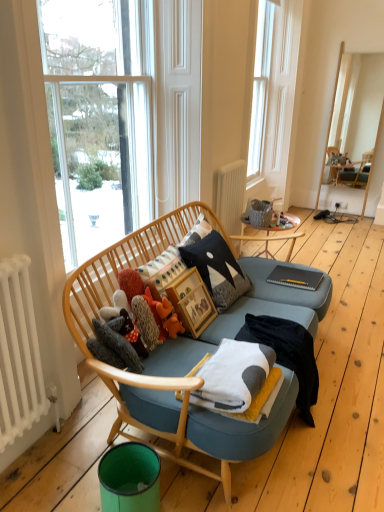
Question: Considering their positions, is transparent glass window at upper center located in front of or behind white soft blanket at center, which is the first blanket from back to front?

Choices:
 (A) behind
 (B) front

Answer: (A)

Question: In terms of width, does transparent glass window at upper center look wider or thinner when compared to white soft blanket at center, which is the first blanket from back to front?

Choices:
 (A) thin
 (B) wide

Answer: (A)

Question: Estimate the real-world distances between objects in this image. Which object is farther from the white soft blanket at center, which is the first blanket from back to front?

Choices:
 (A) white painted radiator at center, acting as the 2th radiator starting from the left
 (B) white radiator at lower left, which appears as the 2th radiator when viewed from the back
 (C) soft yellow fabric footrest at center
 (D) black cotton throw pillow at center
 (E) slate gray notebook at center

Answer: (A)

Question: Based on their relative distances, which object is farther from the soft yellow fabric footrest at center?

Choices:
 (A) transparent glass window at upper center
 (B) white soft blanket at center, arranged as the 1th blanket when viewed from the front
 (C) slate gray notebook at center
 (D) white radiator at lower left, which is the first radiator in bottom-to-top order
 (E) green matte trash can at lower left

Answer: (A)